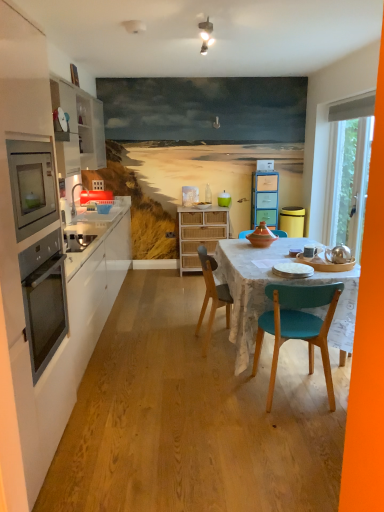
Question: From a real-world perspective, is stainless steel oven at left physically located above or below white ceramic mug at table?

Choices:
 (A) above
 (B) below

Answer: (A)

Question: Is point (41, 146) positioned closer to the camera than point (319, 250)?

Choices:
 (A) farther
 (B) closer

Answer: (B)

Question: Which object is the farthest from the white fabric exhaust hood at upper right?

Choices:
 (A) white ceramic mug at table
 (B) teal glossy jar at center
 (C) matte white plywood at center
 (D) white matte plate at center, placed as the 2th plate when sorted from right to left
 (E) white matte cabinet at left, the 3th cabinetry positioned from the right

Answer: (E)

Question: Considering the real-world distances, which object is farthest from the yellow matte trash bin/can at right?

Choices:
 (A) wooden chair at center
 (B) green plastic drawers at center, the first cabinetry positioned from the back
 (C) transparent glass door at right
 (D) white matte cabinet at left, positioned as the third cabinetry in back-to-front order
 (E) teal glossy jar at center

Answer: (D)